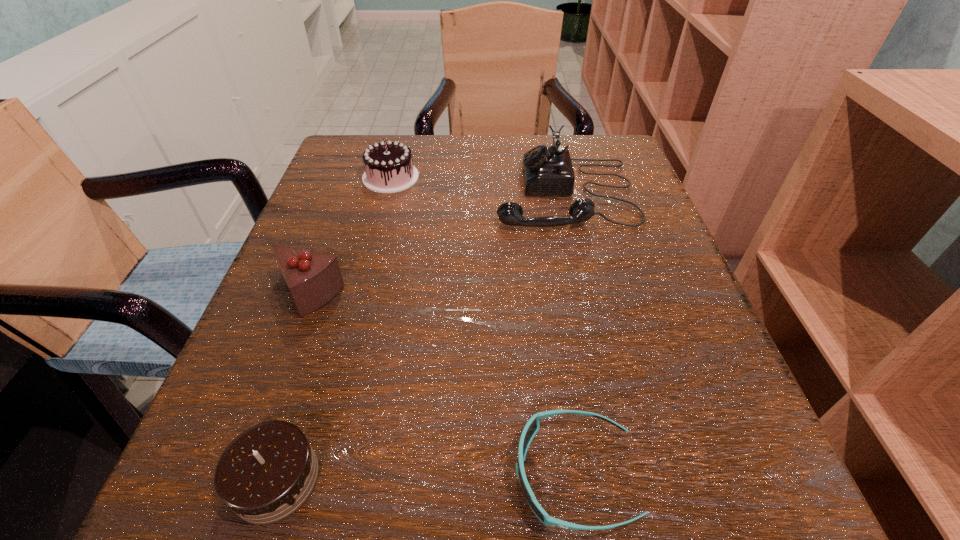
The image size is (960, 540). Find the location of `unoccupied area between the telephone and the farthest chocolate cake`. unoccupied area between the telephone and the farthest chocolate cake is located at coordinates (478, 185).

The image size is (960, 540). In order to click on empty location between the sunglasses and the telephone in this screenshot , I will do `click(569, 334)`.

The width and height of the screenshot is (960, 540). I want to click on empty space between the shortest object and the third nearest object, so click(442, 384).

Identify the location of vacant area that lies between the telephone and the nearest chocolate cake. (420, 336).

At what (x,y) coordinates should I click in order to perform the action: click on free space between the third farthest object and the telephone. Please return your answer as a coordinate pair (x, y). This screenshot has height=540, width=960. Looking at the image, I should click on (437, 244).

Image resolution: width=960 pixels, height=540 pixels. What are the coordinates of `vacant point located between the third farthest object and the nearest chocolate cake` in the screenshot? It's located at (292, 387).

Image resolution: width=960 pixels, height=540 pixels. Find the location of `free space that is in between the nearest chocolate cake and the third nearest object`. free space that is in between the nearest chocolate cake and the third nearest object is located at coordinates (292, 387).

At what (x,y) coordinates should I click in order to perform the action: click on vacant point located between the sunglasses and the farthest chocolate cake. Please return your answer as a coordinate pair (x, y). The height and width of the screenshot is (540, 960). Looking at the image, I should click on (483, 326).

Where is `vacant area between the nearest chocolate cake and the sunglasses`? vacant area between the nearest chocolate cake and the sunglasses is located at coordinates (425, 477).

I want to click on free space between the farthest chocolate cake and the nearest chocolate cake, so click(x=333, y=328).